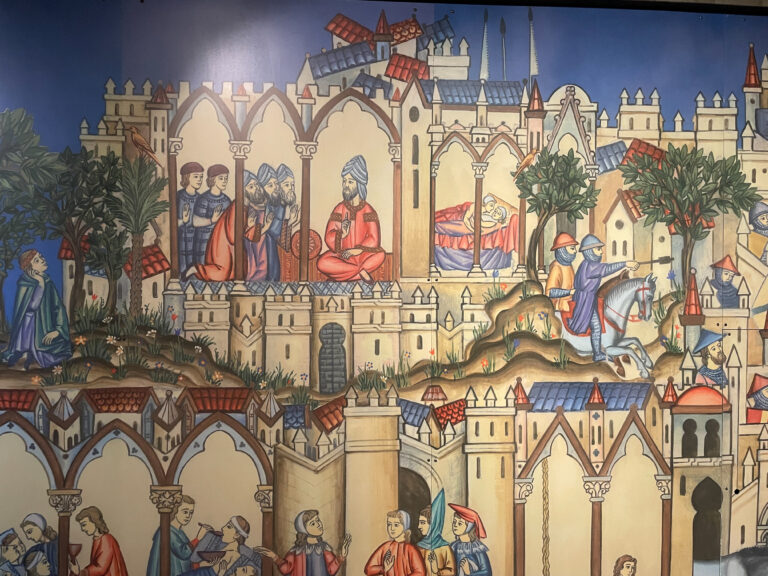
Identify the location of bed. The image size is (768, 576). (498, 246).